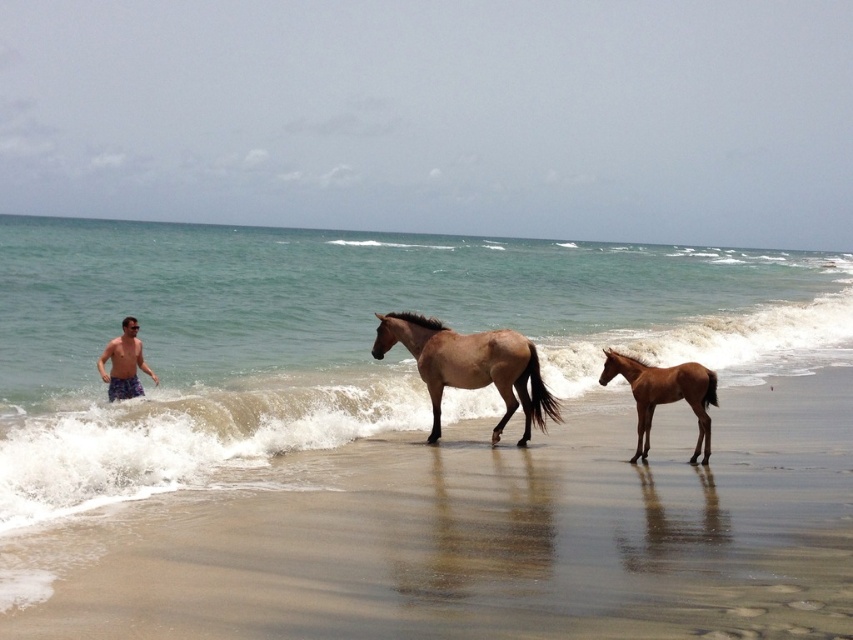
You are standing on the beach and see the clear blue water at left and the blue plaid shorts at left. Which object is positioned to the right of the other?

The clear blue water at left is to the right of the blue plaid shorts at left.

You are a photographer setting up equipment on the beach. You need to place your tripod on the brown sand at lower center without blocking the view of the brown glossy horse at center. Given their widths, can you fit the tripod on the sand while keeping it entirely within the sand area?

The brown sand at lower center is wider than the brown glossy horse at center. Since the sand is wider, you can place the tripod on the brown sand at lower center without blocking the horse, as there is enough space to keep the tripod entirely within the sand area.

You are a photographer trying to capture a shot of the brown sand at lower center and the blue plaid shorts at left. Based on their positions, which object is closer to the camera?

The brown sand at lower center is closer to the camera because it is in front of the blue plaid shorts at left.